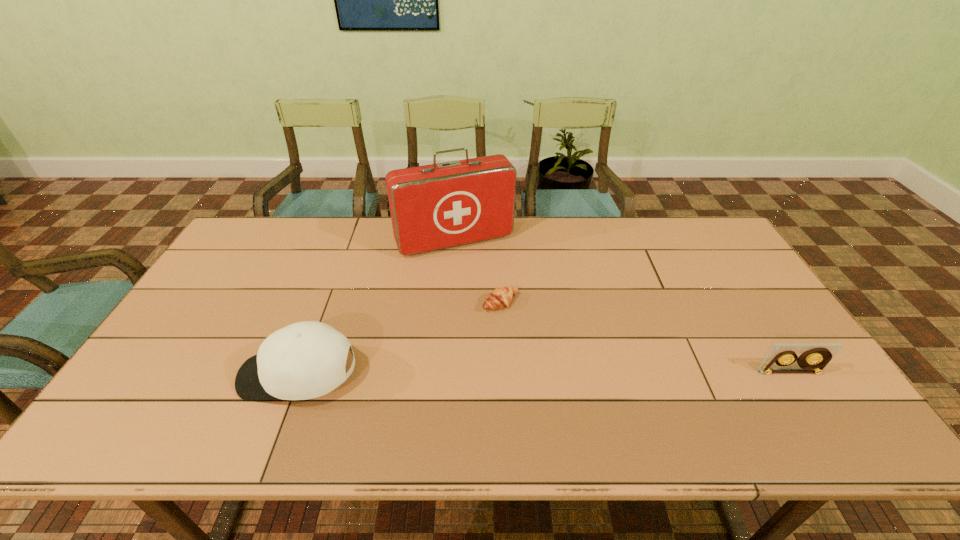
The height and width of the screenshot is (540, 960). In order to click on vacant space on the desktop that is between the baseball cap and the third tallest object and is positioned on the side of the farthest object with the first aid cross symbol in this screenshot , I will do `click(519, 374)`.

The image size is (960, 540). Identify the location of vacant spot on the desktop that is between the third shortest object and the rightmost object and is positioned on the front-facing side of the shortest object. (588, 373).